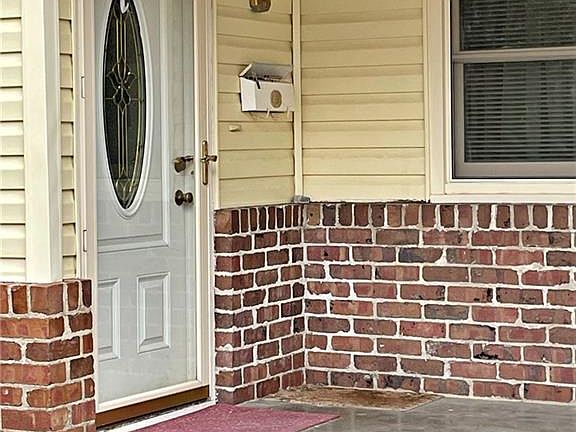
What are the coordinates of `window` in the screenshot? It's located at (121, 95).